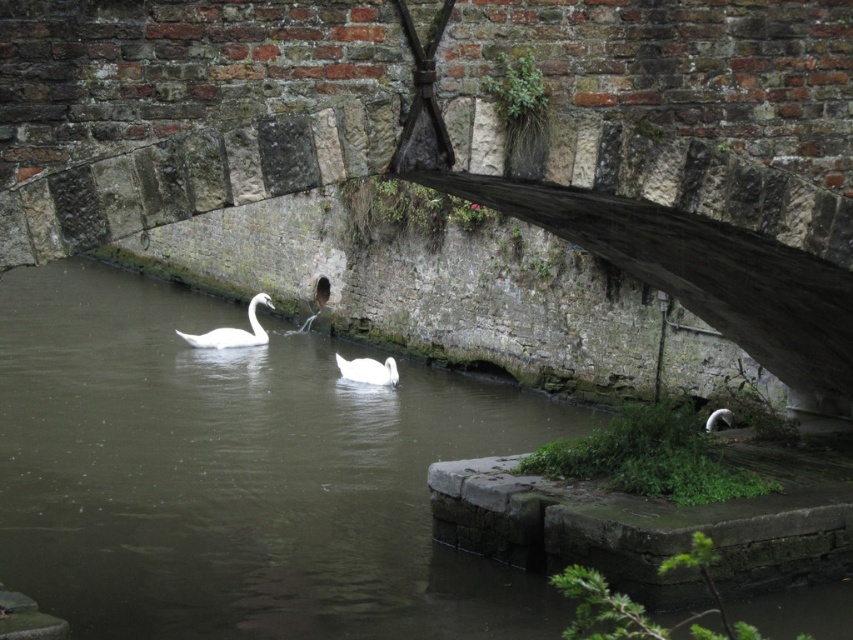
Who is more distant from viewer, (252, 317) or (380, 369)?

Point (252, 317)

Is point (250, 324) positioned after point (345, 372)?

Yes, it is behind point (345, 372).

The height and width of the screenshot is (640, 853). I want to click on white glossy swan at left, so click(x=233, y=330).

Which is behind, point (399, 636) or point (225, 346)?

The point (225, 346) is behind.

Is clear water at center taller than white glossy swan at left?

Correct, clear water at center is much taller as white glossy swan at left.

This screenshot has height=640, width=853. What do you see at coordinates (239, 476) in the screenshot?
I see `clear water at center` at bounding box center [239, 476].

Where is `clear water at center`? clear water at center is located at coordinates (239, 476).

Which is behind, point (209, 314) or point (358, 378)?

The point (209, 314) is behind.

Does clear water at center lie behind white glossy swan at center?

No, it is not.

This screenshot has width=853, height=640. Identify the location of clear water at center. (239, 476).